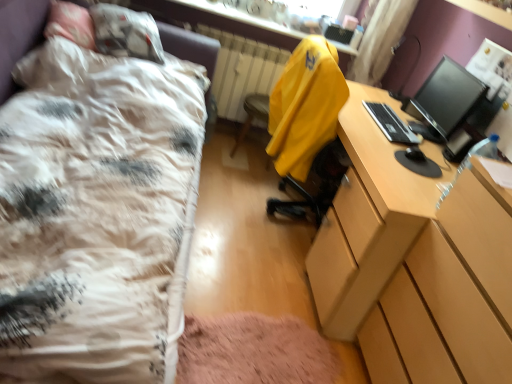
Question: From the image's perspective, is black plastic keyboard at right located above or below yellow fabric jacket at center?

Choices:
 (A) above
 (B) below

Answer: (B)

Question: Is point (391, 130) closer or farther from the camera than point (337, 92)?

Choices:
 (A) closer
 (B) farther

Answer: (B)

Question: Considering the real-world distances, which object is closest to the curtain at upper right?

Choices:
 (A) yellow fabric computer chair at center
 (B) black glossy monitor at upper right
 (C) wooden desk at right
 (D) yellow fabric jacket at center
 (E) white textured bed at left

Answer: (B)

Question: Estimate the real-world distances between objects in this image. Which object is closer to the curtain at upper right?

Choices:
 (A) yellow fabric computer chair at center
 (B) black plastic keyboard at right
 (C) white striped radiator at center
 (D) yellow fabric jacket at center
 (E) white textured bed at left

Answer: (C)